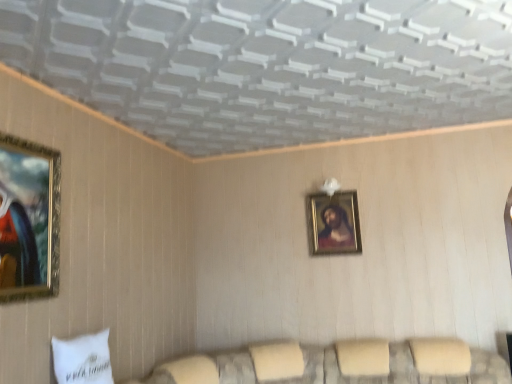
Question: Is gold-framed painting at left, arranged as the 1th picture frame when viewed from the front, completely or partially outside of white fabric pillow at lower left?

Choices:
 (A) no
 (B) yes

Answer: (B)

Question: Considering the relative sizes of gold-framed painting at left, the 1th picture frame when ordered from left to right, and white fabric pillow at lower left in the image provided, is gold-framed painting at left, the 1th picture frame when ordered from left to right, smaller than white fabric pillow at lower left?

Choices:
 (A) yes
 (B) no

Answer: (A)

Question: Is white fabric pillow at lower left located within gold-framed painting at left, which appears as the 2th picture frame when viewed from the right?

Choices:
 (A) yes
 (B) no

Answer: (B)

Question: Considering the relative sizes of gold-framed painting at left, which appears as the 2th picture frame when viewed from the right, and white fabric pillow at lower left in the image provided, is gold-framed painting at left, which appears as the 2th picture frame when viewed from the right, thinner than white fabric pillow at lower left?

Choices:
 (A) no
 (B) yes

Answer: (B)

Question: Could you tell me if gold-framed painting at left, the 2th picture frame positioned from the back, is turned towards white fabric pillow at lower left?

Choices:
 (A) yes
 (B) no

Answer: (B)

Question: From a real-world perspective, is gold-framed painting at left, arranged as the 1th picture frame when viewed from the front, below white fabric pillow at lower left?

Choices:
 (A) no
 (B) yes

Answer: (A)

Question: Is velvet beige couch at lower center directly adjacent to white fabric pillow at lower left?

Choices:
 (A) yes
 (B) no

Answer: (B)

Question: Is velvet beige couch at lower center to the left of white fabric pillow at lower left from the viewer's perspective?

Choices:
 (A) yes
 (B) no

Answer: (B)

Question: Is velvet beige couch at lower center closer to the viewer compared to white fabric pillow at lower left?

Choices:
 (A) yes
 (B) no

Answer: (B)

Question: Does velvet beige couch at lower center turn towards white fabric pillow at lower left?

Choices:
 (A) no
 (B) yes

Answer: (A)

Question: Is velvet beige couch at lower center thinner than white fabric pillow at lower left?

Choices:
 (A) yes
 (B) no

Answer: (B)

Question: From a real-world perspective, is velvet beige couch at lower center located beneath white fabric pillow at lower left?

Choices:
 (A) no
 (B) yes

Answer: (B)

Question: Is gold-framed portrait at center, the first picture frame when ordered from right to left, thinner than white fabric pillow at lower left?

Choices:
 (A) yes
 (B) no

Answer: (A)